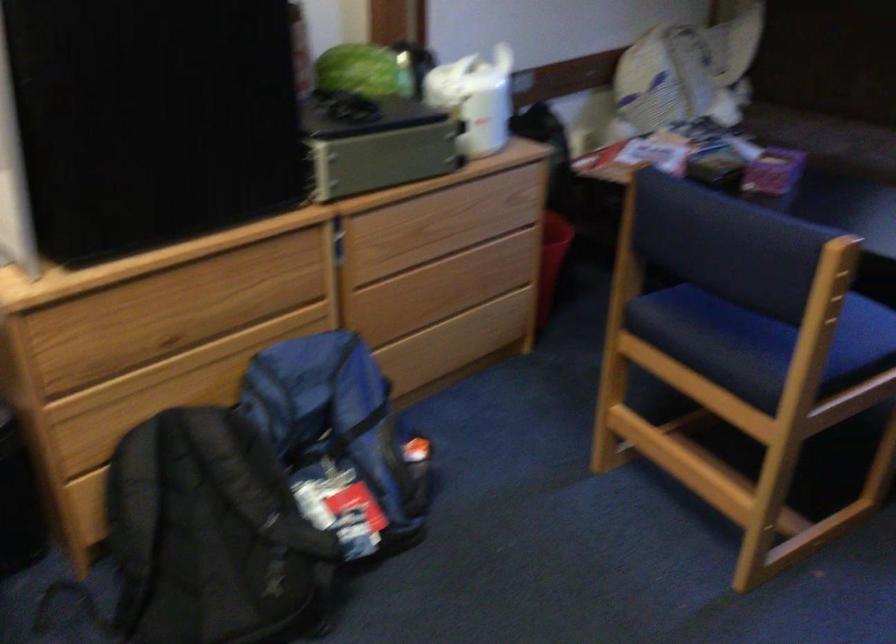
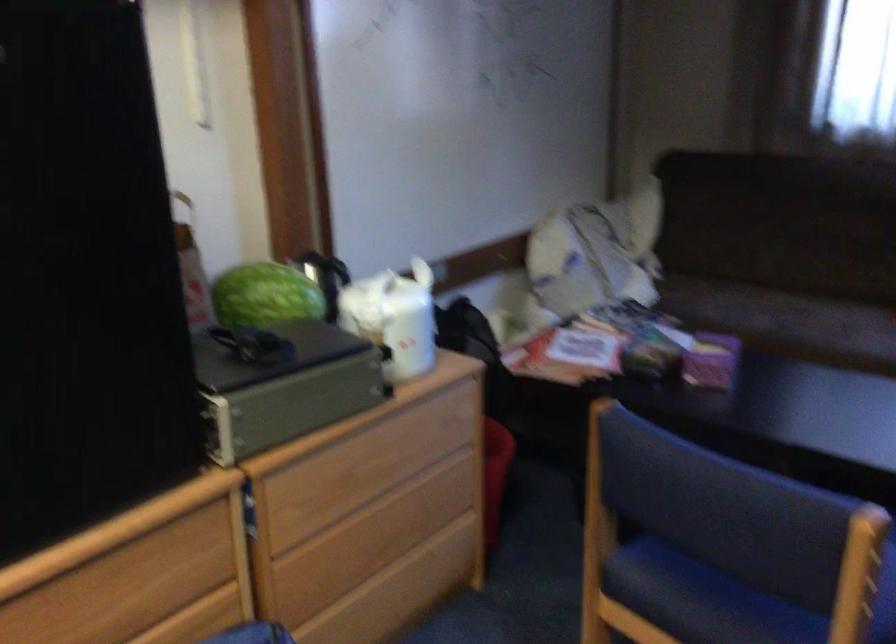
Where in the second image is the point corresponding to pixel 359 69 from the first image?

(264, 295)